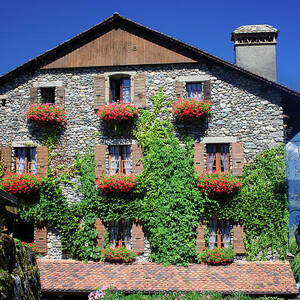
The width and height of the screenshot is (300, 300). I want to click on curtains, so click(113, 165).